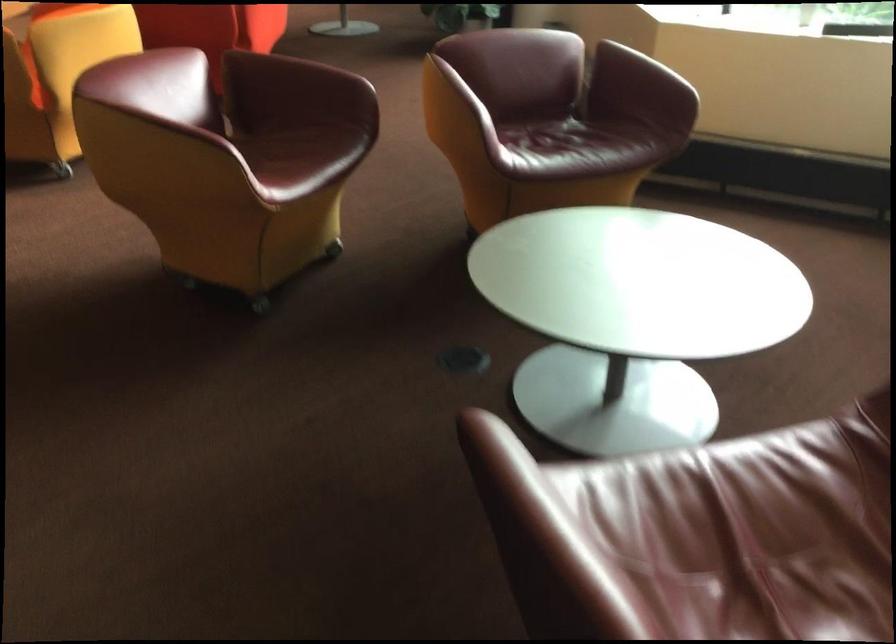
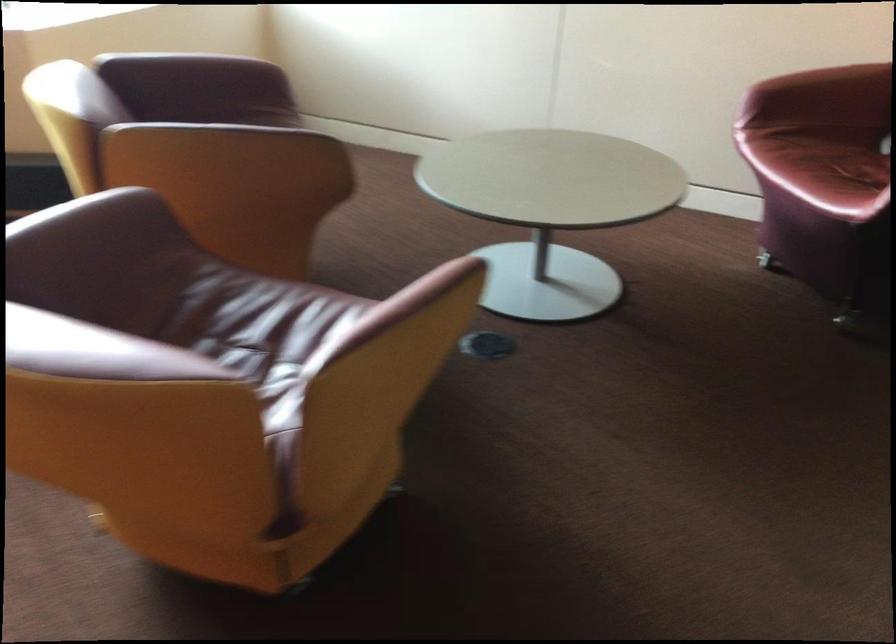
Where in the second image is the point corresponding to point 295,169 from the first image?

(250, 323)